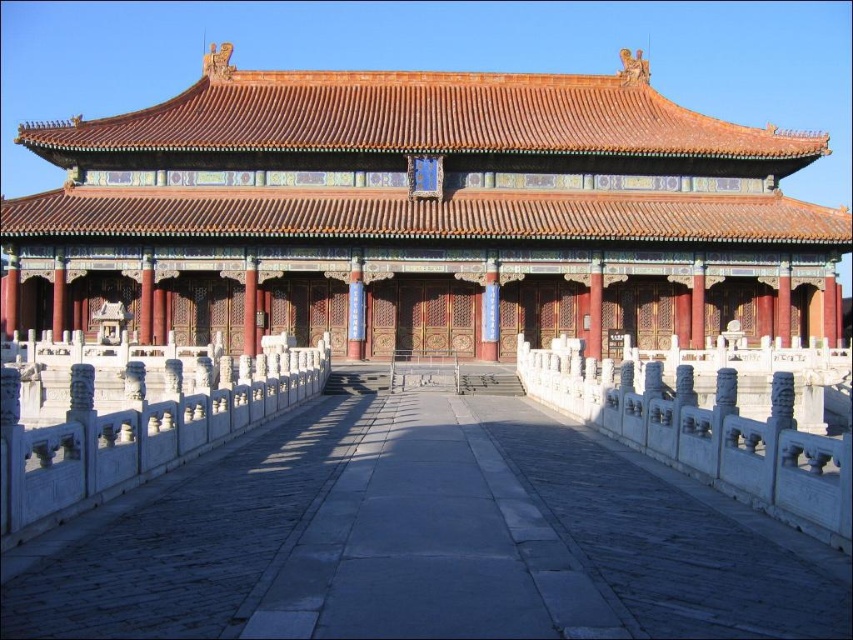
Is matte gold roof at center thinner than white marble railing at center?

No, matte gold roof at center is not thinner than white marble railing at center.

This screenshot has width=853, height=640. I want to click on matte gold roof at center, so click(x=412, y=202).

Identify the location of matte gold roof at center. (412, 202).

Does white marble railing at left have a greater width compared to white marble railing at center?

No, white marble railing at left is not wider than white marble railing at center.

Is white marble railing at left in front of white marble railing at center?

That is True.

Who is more distant from viewer, [207,394] or [817,470]?

Point [207,394]

Identify the location of white marble railing at left. This screenshot has width=853, height=640. (138, 429).

Which is in front, point (387, 205) or point (231, 378)?

Point (231, 378) is more forward.

Looking at this image, does matte gold roof at center have a smaller size compared to white marble railing at left?

No.

Is point (497, 246) behind point (85, 481)?

That is True.

The height and width of the screenshot is (640, 853). What are the coordinates of `matte gold roof at center` in the screenshot? It's located at (412, 202).